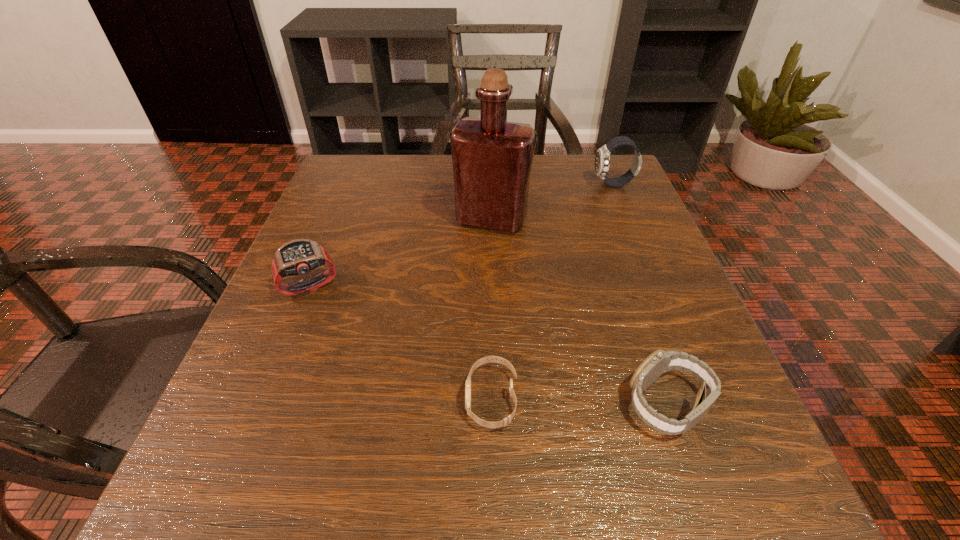
Locate an element on the screen. The width and height of the screenshot is (960, 540). free space at the far edge is located at coordinates (554, 207).

In the image, there is a desktop. Identify the location of blank space at the near edge. Image resolution: width=960 pixels, height=540 pixels. (x=336, y=476).

The height and width of the screenshot is (540, 960). I want to click on vacant space at the left edge of the desktop, so click(x=282, y=341).

Image resolution: width=960 pixels, height=540 pixels. I want to click on vacant area at the right edge, so click(587, 219).

What are the coordinates of `free space at the far left corner of the desktop` in the screenshot? It's located at (359, 173).

Identify the location of vacant space at the near left corner. The image size is (960, 540). (182, 508).

Where is `empty space that is in between the tallest object and the shortest watch`? empty space that is in between the tallest object and the shortest watch is located at coordinates click(x=492, y=309).

At what (x,y) coordinates should I click in order to perform the action: click on vacant area between the liquor and the leftmost object. Please return your answer as a coordinate pair (x, y). The height and width of the screenshot is (540, 960). Looking at the image, I should click on (400, 253).

The image size is (960, 540). What are the coordinates of `object that is the third nearest to the second farthest object` in the screenshot? It's located at (506, 421).

Find the location of a particular element. Image resolution: width=960 pixels, height=540 pixels. the closest object relative to the shortest object is located at coordinates (660, 362).